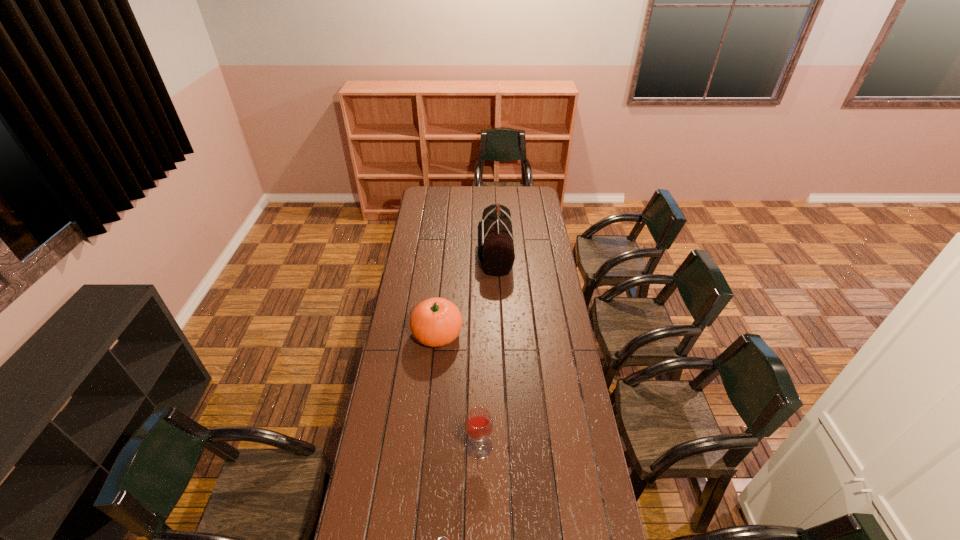
You are a GUI agent. You are given a task and a screenshot of the screen. Output one action in this format:
    pyautogui.click(x=<x>, y=<y>)
    Task: Click on the object that stands as the closest to the pumpkin
    This screenshot has width=960, height=540.
    Given the screenshot: What is the action you would take?
    pyautogui.click(x=495, y=249)

At what (x,y) coordinates should I click in order to perform the action: click on the closest object to the wineglass. Please return your answer as a coordinate pair (x, y). Looking at the image, I should click on (442, 539).

Locate an element on the screen. free space that satisfies the following two spatial constraints: 1. on the front pocket of the tallest object; 2. on the front side of the pumpkin is located at coordinates (498, 334).

Find the location of a particular element. The image size is (960, 540). vacant space that satisfies the following two spatial constraints: 1. on the front side of the pumpkin; 2. on the left side of the wineglass is located at coordinates (426, 447).